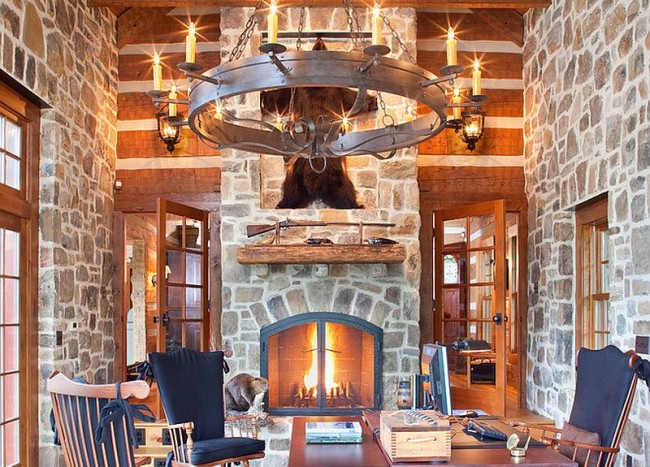
Image resolution: width=650 pixels, height=467 pixels. I want to click on glass panel wooden doors, so click(x=494, y=398), click(x=175, y=283).